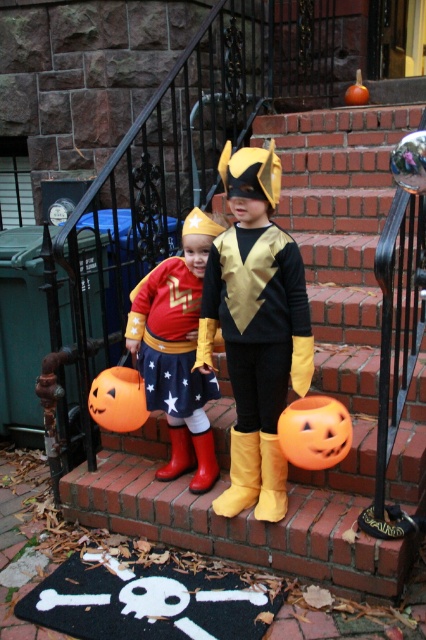
In the scene shown: You are a photographer trying to capture a photo of both the brick stairs at center and the orange matte pumpkin at center. Based on their positions, which object should you focus on first to ensure both are in frame?

The brick stairs at center is in front of the orange matte pumpkin at center, so you should focus on the brick stairs at center first to ensure both are in frame.

You are a delivery robot with a 24 inch wide package. You need to move from the brick stairs at center to the metallic gold costume at center. Can you fit through the space between them?

The brick stairs at center is 26.07 inches away from the metallic gold costume at center. Since the package is 24 inches wide, it can fit through the space between them.

You are a delivery robot trying to navigate to the brick stairs at center. The coordinates given are point (311, 381). Can you confirm if this point corresponds to the location of the brick stairs?

Yes, the point (311, 381) marks the brick stairs at center, so the delivery robot can navigate to that coordinate for the stairs.